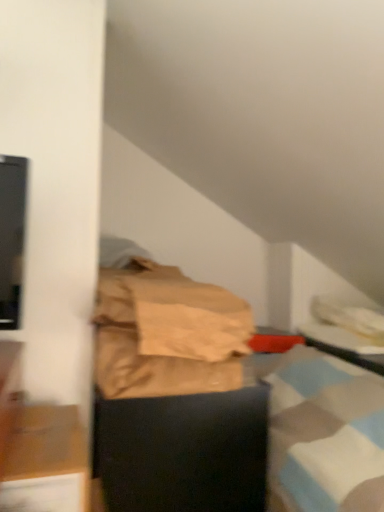
Question: Looking at their shapes, would you say black glossy table at right is wider or thinner than wooden cabinet at lower left, marked as the 2th furniture in a back-to-front arrangement?

Choices:
 (A) thin
 (B) wide

Answer: (B)

Question: Is black glossy table at right inside or outside of wooden cabinet at lower left, which appears as the first furniture when viewed from the front?

Choices:
 (A) outside
 (B) inside

Answer: (A)

Question: Which object is the farthest from the wooden cabinet at lower left, which appears as the first furniture when viewed from the front?

Choices:
 (A) black matte box at center, positioned as the 1th furniture in back-to-front order
 (B) black glossy table at right
 (C) brown paper bag at center

Answer: (B)

Question: Which object is positioned farthest from the black glossy table at right?

Choices:
 (A) black matte box at center, placed as the 2th furniture when sorted from front to back
 (B) wooden cabinet at lower left, marked as the 2th furniture in a back-to-front arrangement
 (C) brown paper bag at center

Answer: (B)